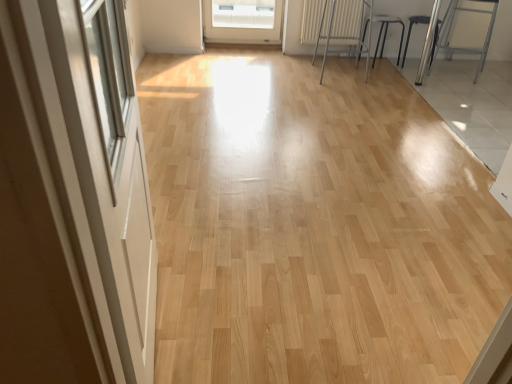
Question: Can you confirm if white glossy screen door at left is wider than metallic silver stool at upper right, which is the first armchair from left to right?

Choices:
 (A) no
 (B) yes

Answer: (A)

Question: Is white glossy screen door at left closer to the viewer compared to metallic silver stool at upper right, which is the first armchair from left to right?

Choices:
 (A) yes
 (B) no

Answer: (A)

Question: Is white glossy screen door at left placed right next to metallic silver stool at upper right, which is the first armchair from left to right?

Choices:
 (A) no
 (B) yes

Answer: (A)

Question: Is white glossy screen door at left not inside metallic silver stool at upper right, which is the 3th armchair from right to left?

Choices:
 (A) yes
 (B) no

Answer: (A)

Question: From the image's perspective, is white glossy screen door at left under metallic silver stool at upper right, which is the 3th armchair from right to left?

Choices:
 (A) yes
 (B) no

Answer: (A)

Question: Is white glossy screen door at left behind metallic silver stool at upper right, which is the first armchair from left to right?

Choices:
 (A) no
 (B) yes

Answer: (A)

Question: Is metallic silver stool at upper right, which is the first armchair from left to right, oriented towards white textured radiator at upper center?

Choices:
 (A) no
 (B) yes

Answer: (A)

Question: Is metallic silver stool at upper right, which is the 3th armchair from right to left, positioned behind white textured radiator at upper center?

Choices:
 (A) yes
 (B) no

Answer: (B)

Question: Can you confirm if metallic silver stool at upper right, which is the first armchair from left to right, is thinner than white textured radiator at upper center?

Choices:
 (A) yes
 (B) no

Answer: (B)

Question: Considering the relative sizes of metallic silver stool at upper right, which is the 3th armchair from right to left, and white textured radiator at upper center in the image provided, is metallic silver stool at upper right, which is the 3th armchair from right to left, taller than white textured radiator at upper center?

Choices:
 (A) yes
 (B) no

Answer: (A)

Question: Is metallic silver stool at upper right, which is the 3th armchair from right to left, shorter than white textured radiator at upper center?

Choices:
 (A) yes
 (B) no

Answer: (B)

Question: Are metallic silver stool at upper right, which is the 3th armchair from right to left, and white textured radiator at upper center making contact?

Choices:
 (A) no
 (B) yes

Answer: (A)

Question: Is white textured radiator at upper center located outside metallic silver armchair at right, the third armchair positioned from the left?

Choices:
 (A) yes
 (B) no

Answer: (A)